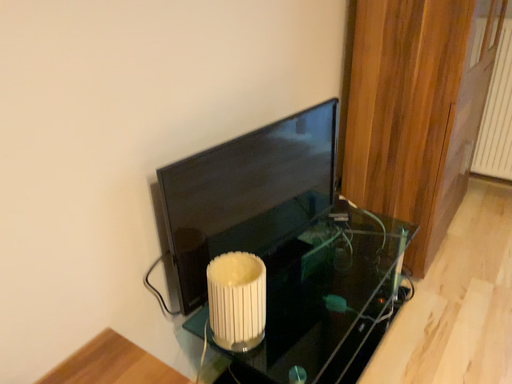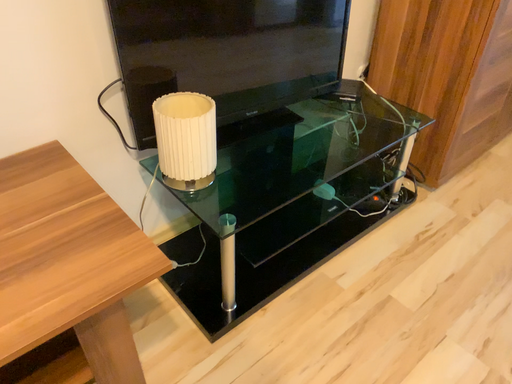
Question: How did the camera likely rotate when shooting the video?

Choices:
 (A) rotated left
 (B) rotated right

Answer: (A)